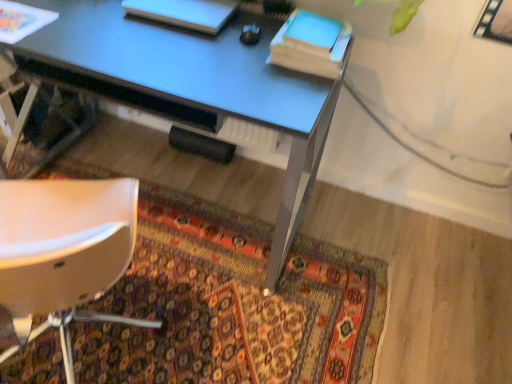
Question: Is blue matte notepad at upper right aimed at carpeted rug at lower center?

Choices:
 (A) yes
 (B) no

Answer: (B)

Question: Is blue matte notepad at upper right closer to camera compared to carpeted rug at lower center?

Choices:
 (A) yes
 (B) no

Answer: (B)

Question: Is blue matte notepad at upper right smaller than carpeted rug at lower center?

Choices:
 (A) no
 (B) yes

Answer: (B)

Question: Considering the relative sizes of blue matte notepad at upper right and carpeted rug at lower center in the image provided, is blue matte notepad at upper right taller than carpeted rug at lower center?

Choices:
 (A) no
 (B) yes

Answer: (B)

Question: Does blue matte notepad at upper right appear on the right side of carpeted rug at lower center?

Choices:
 (A) yes
 (B) no

Answer: (A)

Question: From the image's perspective, is white matte book at upper center, the first book in the left-to-right sequence, positioned above or below white plastic chair at lower left?

Choices:
 (A) above
 (B) below

Answer: (A)

Question: Would you say white matte book at upper center, marked as the second book in a right-to-left arrangement, is inside or outside white plastic chair at lower left?

Choices:
 (A) outside
 (B) inside

Answer: (A)

Question: From a real-world perspective, is white matte book at upper center, marked as the second book in a right-to-left arrangement, above or below white plastic chair at lower left?

Choices:
 (A) below
 (B) above

Answer: (B)

Question: Considering the positions of white matte book at upper center, the first book in the left-to-right sequence, and white plastic chair at lower left in the image, is white matte book at upper center, the first book in the left-to-right sequence, wider or thinner than white plastic chair at lower left?

Choices:
 (A) wide
 (B) thin

Answer: (B)

Question: Considering the positions of white plastic chair at lower left and metallic blue desk at center in the image, is white plastic chair at lower left wider or thinner than metallic blue desk at center?

Choices:
 (A) thin
 (B) wide

Answer: (B)

Question: Is white plastic chair at lower left in front of or behind metallic blue desk at center in the image?

Choices:
 (A) front
 (B) behind

Answer: (A)

Question: From a real-world perspective, relative to metallic blue desk at center, is white plastic chair at lower left vertically above or below?

Choices:
 (A) below
 (B) above

Answer: (B)

Question: Based on their sizes in the image, would you say white plastic chair at lower left is bigger or smaller than metallic blue desk at center?

Choices:
 (A) small
 (B) big

Answer: (A)

Question: Considering the positions of white matte book at upper center, marked as the second book in a right-to-left arrangement, and metallic blue desk at center in the image, is white matte book at upper center, marked as the second book in a right-to-left arrangement, taller or shorter than metallic blue desk at center?

Choices:
 (A) tall
 (B) short

Answer: (B)

Question: Is white matte book at upper center, marked as the second book in a right-to-left arrangement, bigger or smaller than metallic blue desk at center?

Choices:
 (A) small
 (B) big

Answer: (A)